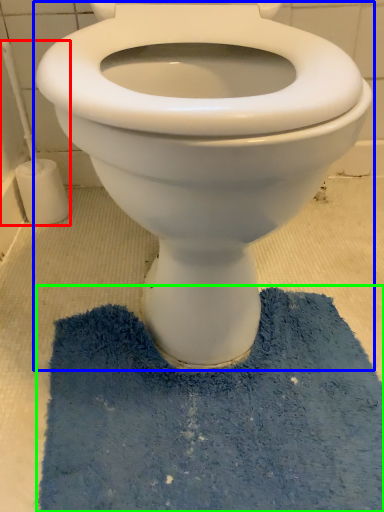
Question: Considering the real-world distances, which object is farthest from brush (highlighted by a red box)? toilet (highlighted by a blue box) or bath mat (highlighted by a green box)?

Choices:
 (A) toilet
 (B) bath mat

Answer: (B)